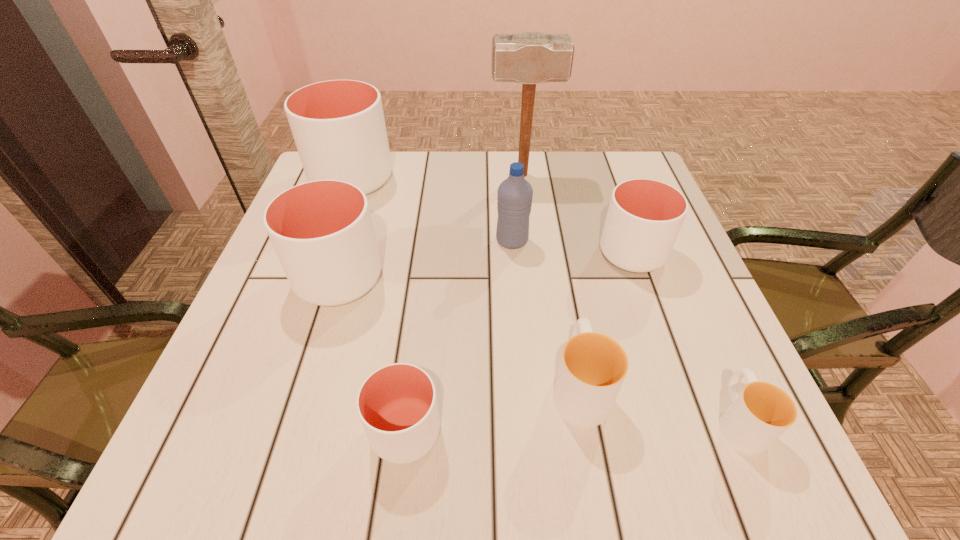
Where is `mallet`? This screenshot has width=960, height=540. mallet is located at coordinates (530, 58).

You are a GUI agent. You are given a task and a screenshot of the screen. Output one action in this format:
    pyautogui.click(x=<x>, y=<y>)
    Task: Click on the farthest white cup
    Image resolution: width=960 pixels, height=540 pixels.
    Given the screenshot: What is the action you would take?
    pyautogui.click(x=338, y=126)

The width and height of the screenshot is (960, 540). Identify the location of the farthest cup. (338, 126).

The height and width of the screenshot is (540, 960). I want to click on water bottle, so click(x=514, y=201).

This screenshot has width=960, height=540. What are the coordinates of `the third smallest white cup` in the screenshot? It's located at (322, 231).

Locate an element on the screen. The height and width of the screenshot is (540, 960). the rightmost white cup is located at coordinates (644, 217).

The height and width of the screenshot is (540, 960). Identify the location of the third tallest cup. (644, 217).

The image size is (960, 540). In order to click on the bigger yellow cup in this screenshot , I will do `click(593, 366)`.

The image size is (960, 540). Find the location of `the left yellow cup`. the left yellow cup is located at coordinates (593, 366).

Where is `the smallest white cup`? The image size is (960, 540). the smallest white cup is located at coordinates (397, 404).